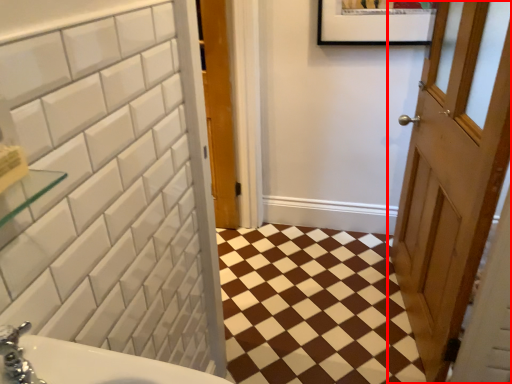
Question: From the image's perspective, where is door (annotated by the red box) located relative to ceramic tile?

Choices:
 (A) above
 (B) below

Answer: (A)